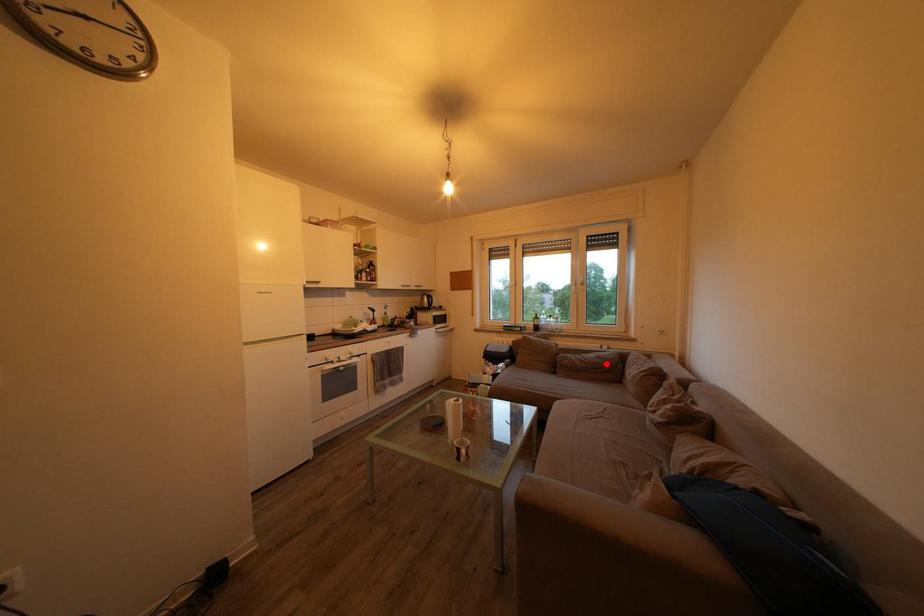
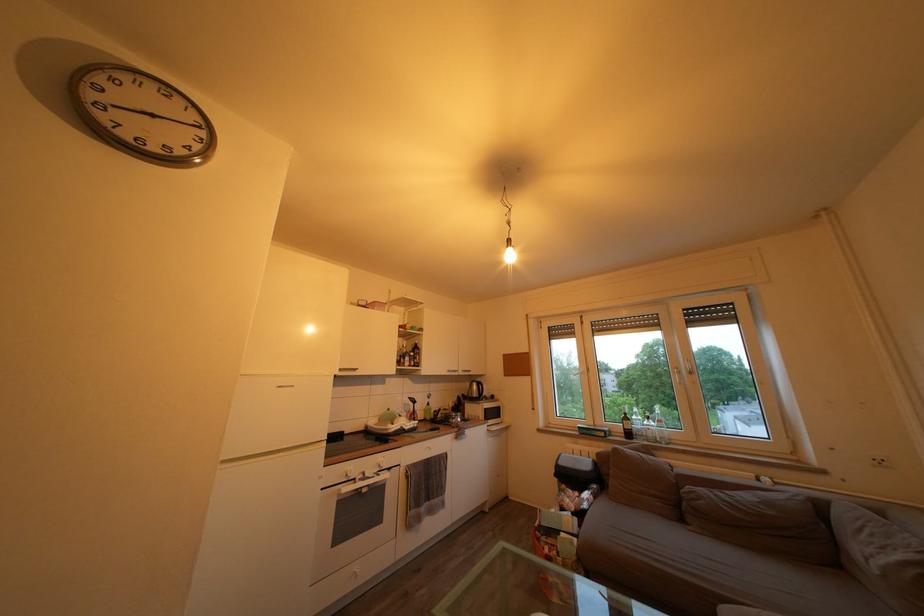
In the second image, find the point that corresponds to the highlighted location in the first image.

(774, 509)